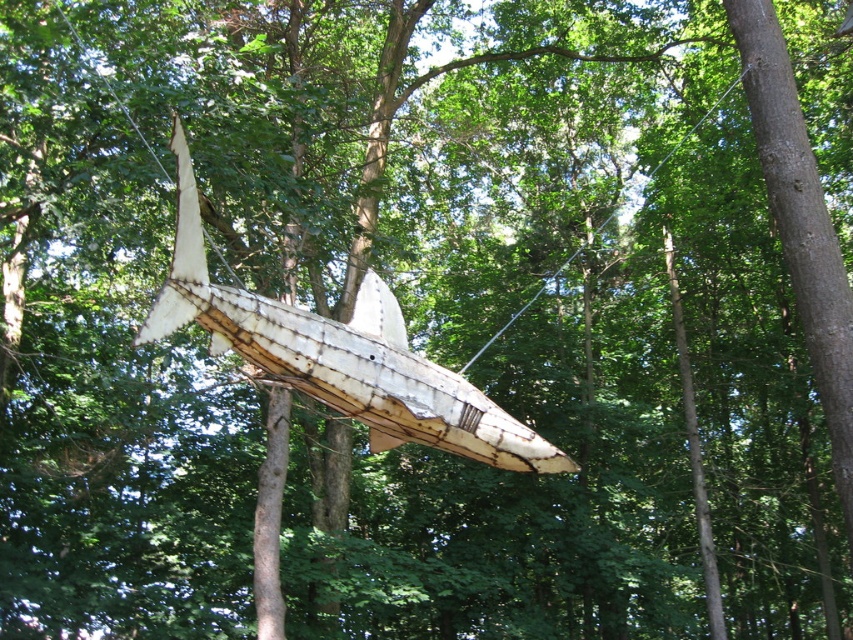
Is point (376, 412) positioned before point (602, 221)?

Yes, point (376, 412) is closer to viewer.

Is rusty wood boat at center bigger than clear wire at center?

No.

Is point (459, 388) in front of point (643, 200)?

Yes, point (459, 388) is closer to viewer.

Where is `rusty wood boat at center`? The image size is (853, 640). rusty wood boat at center is located at coordinates (340, 355).